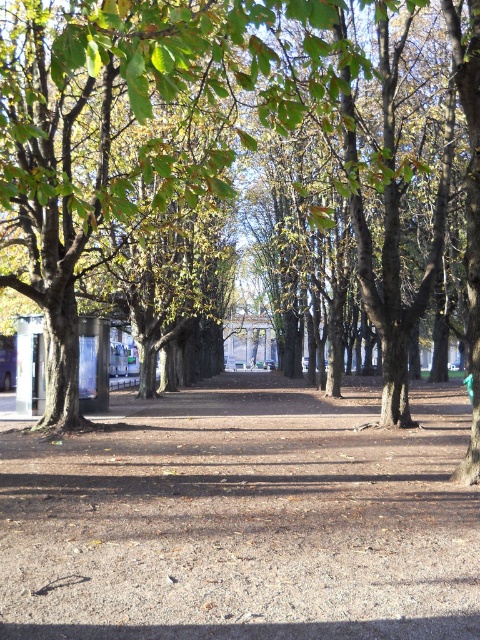
Question: Which of the following is the closest to the observer?

Choices:
 (A) (73, 240)
 (B) (336, 458)

Answer: (B)

Question: Can you confirm if brown gravel path at center is bigger than green leafy tree at center?

Choices:
 (A) yes
 (B) no

Answer: (B)

Question: Can you confirm if brown gravel path at center is positioned to the left of green leafy tree at center?

Choices:
 (A) no
 (B) yes

Answer: (A)

Question: Which point is closer to the camera taking this photo?

Choices:
 (A) (101, 182)
 (B) (8, 564)

Answer: (B)

Question: Can you confirm if brown gravel path at center is thinner than green leafy tree at center?

Choices:
 (A) no
 (B) yes

Answer: (A)